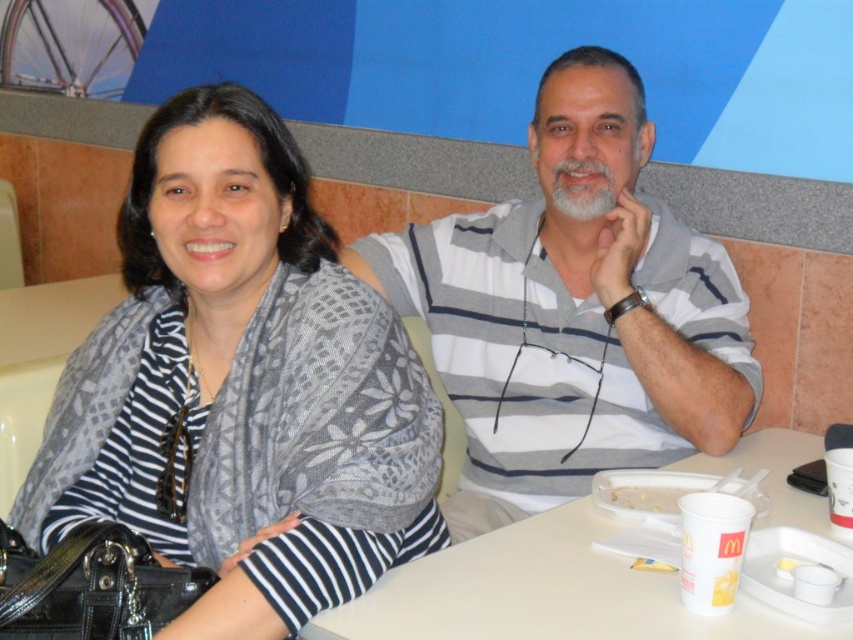
You are a delivery person who needs to place a new tray at the exact coordinates of point (544, 593). According to the scene, what object is already present at that location?

The white plastic tray at lower center is already present at point (544, 593).

You are a photographer trying to capture a photo of the gray striped shirt at center and the white plastic tray at lower center. Which object should you focus on first if you want to ensure both are in focus, considering their heights?

The gray striped shirt at center is taller than the white plastic tray at lower center, so you should focus on the gray striped shirt at center first to ensure both are in focus.